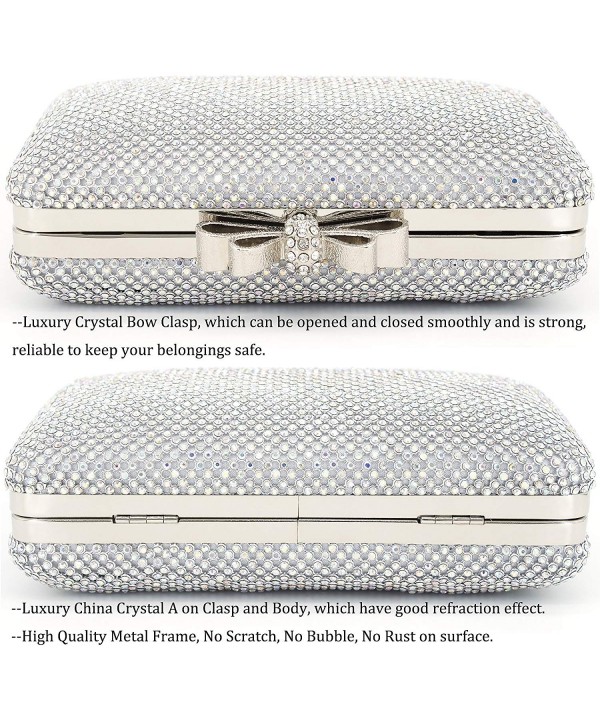
The width and height of the screenshot is (600, 720). In order to click on crystal beads in this screenshot , I will do 189,570, 208,585, 379,495, 66,432, 346,407.